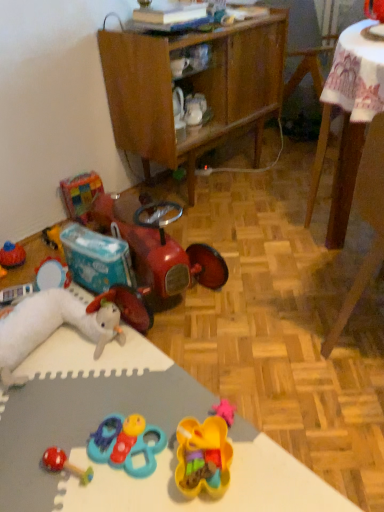
Question: From the image's perspective, is rubberized red car at lower left, placed as the fourth toy when sorted from right to left, located beneath teal plastic toy at center, positioned as the 3th toy in right-to-left order?

Choices:
 (A) no
 (B) yes

Answer: (A)

Question: Is teal plastic toy at center, which appears as the fourth toy when viewed from the left, located within rubberized red car at lower left, positioned as the 3th toy in left-to-right order?

Choices:
 (A) yes
 (B) no

Answer: (B)

Question: Considering the relative sizes of rubberized red car at lower left, positioned as the 3th toy in left-to-right order, and teal plastic toy at center, which appears as the fourth toy when viewed from the left, in the image provided, is rubberized red car at lower left, positioned as the 3th toy in left-to-right order, wider than teal plastic toy at center, which appears as the fourth toy when viewed from the left,?

Choices:
 (A) yes
 (B) no

Answer: (A)

Question: Considering the relative positions of rubberized red car at lower left, placed as the fourth toy when sorted from right to left, and teal plastic toy at center, which appears as the fourth toy when viewed from the left, in the image provided, is rubberized red car at lower left, placed as the fourth toy when sorted from right to left, to the left of teal plastic toy at center, which appears as the fourth toy when viewed from the left, from the viewer's perspective?

Choices:
 (A) no
 (B) yes

Answer: (B)

Question: Does rubberized red car at lower left, positioned as the 3th toy in left-to-right order, touch teal plastic toy at center, which appears as the fourth toy when viewed from the left?

Choices:
 (A) no
 (B) yes

Answer: (A)

Question: Can you confirm if rubberized red car at lower left, positioned as the 3th toy in left-to-right order, is taller than teal plastic toy at center, which appears as the fourth toy when viewed from the left?

Choices:
 (A) no
 (B) yes

Answer: (B)

Question: Is the position of wooden chair at lower right more distant than that of rubberized red car at lower left, positioned as the 3th toy in left-to-right order?

Choices:
 (A) no
 (B) yes

Answer: (A)

Question: Is wooden chair at lower right oriented towards rubberized red car at lower left, positioned as the 3th toy in left-to-right order?

Choices:
 (A) no
 (B) yes

Answer: (A)

Question: From the image's perspective, does wooden chair at lower right appear lower than rubberized red car at lower left, placed as the fourth toy when sorted from right to left?

Choices:
 (A) no
 (B) yes

Answer: (B)

Question: Is wooden chair at lower right surrounding rubberized red car at lower left, positioned as the 3th toy in left-to-right order?

Choices:
 (A) yes
 (B) no

Answer: (B)

Question: Can we say wooden chair at lower right lies outside rubberized red car at lower left, placed as the fourth toy when sorted from right to left?

Choices:
 (A) no
 (B) yes

Answer: (B)

Question: Does wooden chair at lower right have a lesser height compared to rubberized red car at lower left, positioned as the 3th toy in left-to-right order?

Choices:
 (A) yes
 (B) no

Answer: (B)

Question: From the image's perspective, is rubber duck at center, which appears as the sixth toy when viewed from the left, on white plush rabbit at lower left, arranged as the sixth toy when viewed from the right?

Choices:
 (A) yes
 (B) no

Answer: (A)